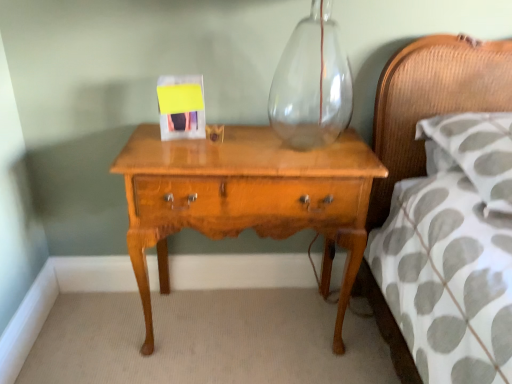
Find the location of a particular element. Image resolution: width=512 pixels, height=384 pixels. free space below light brown wood nightstand at center (from a real-world perspective) is located at coordinates (250, 318).